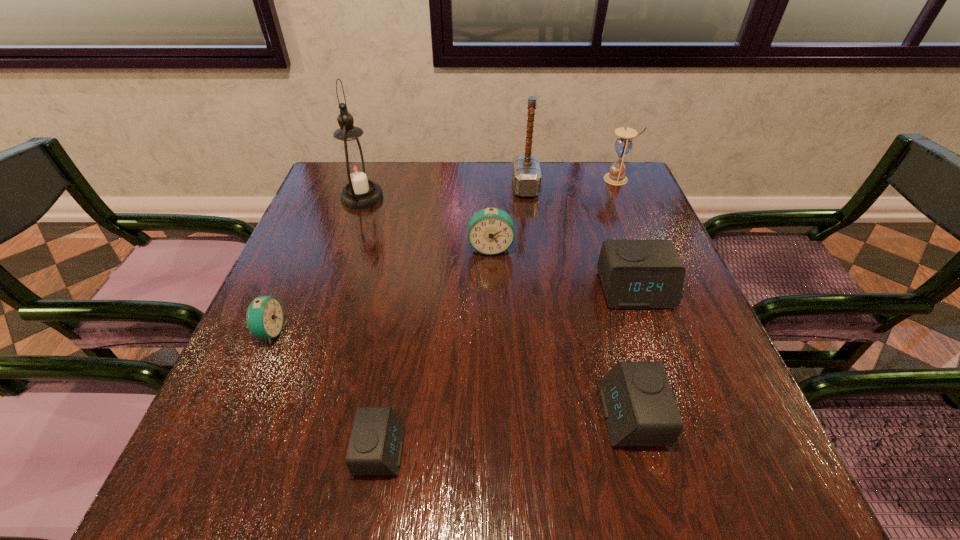
Find the location of a particular element. free spot that satisfies the following two spatial constraints: 1. on the striking surface of the hammer; 2. on the front side of the second object from left to right is located at coordinates 527,198.